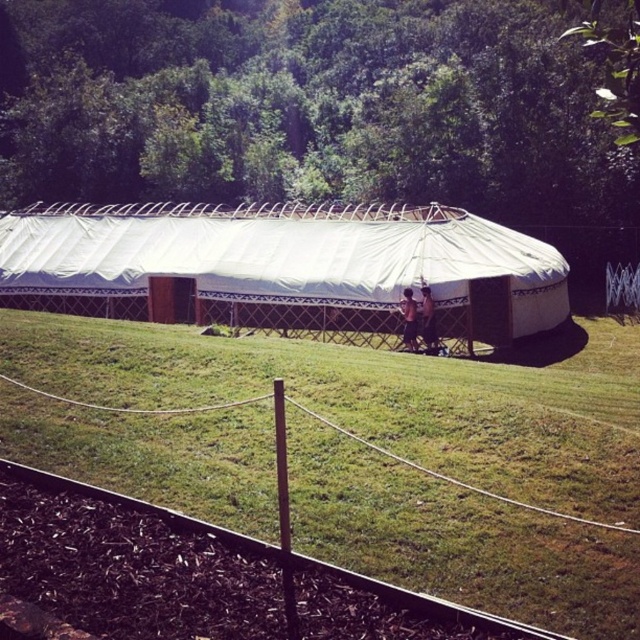
Question: Can you confirm if white canvas tent at center is positioned above light brown wooden chair at center?

Choices:
 (A) no
 (B) yes

Answer: (B)

Question: Among these points, which one is nearest to the camera?

Choices:
 (A) (500, 600)
 (B) (417, 326)
 (C) (628, 275)

Answer: (A)

Question: Does green grass at center have a lesser width compared to light brown wooden chair at center?

Choices:
 (A) yes
 (B) no

Answer: (B)

Question: Among these points, which one is farthest from the camera?

Choices:
 (A) (204, 356)
 (B) (416, 316)
 (C) (353, 296)

Answer: (C)

Question: Which object appears farthest from the camera in this image?

Choices:
 (A) metallic wire fence at center
 (B) light brown wooden chair at center

Answer: (A)

Question: Is white canvas tent at center to the right of metallic wire fence at center from the viewer's perspective?

Choices:
 (A) yes
 (B) no

Answer: (B)